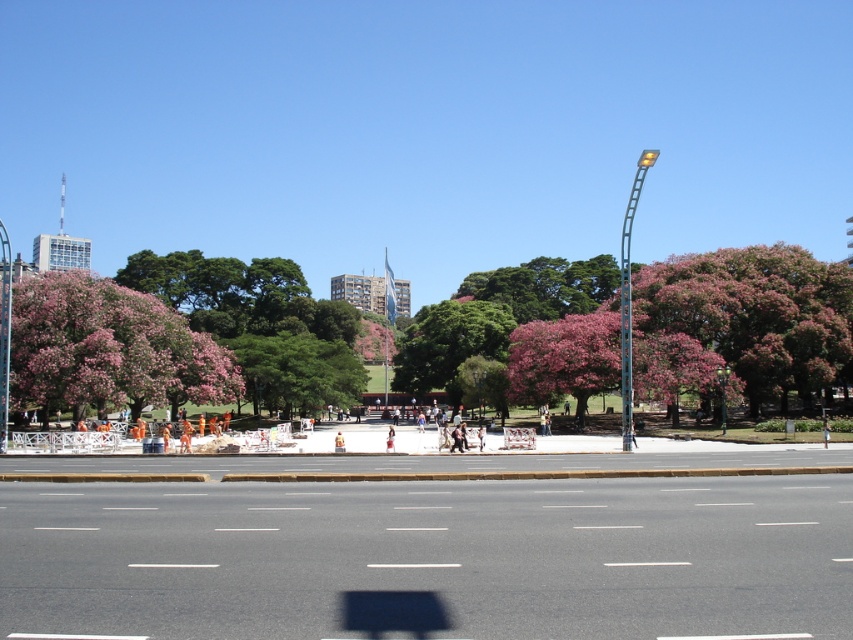
What do you see at coordinates (756, 314) in the screenshot? I see `pink matte tree at upper right` at bounding box center [756, 314].

Which is below, pink matte tree at upper right or pink textured tree at center?

pink textured tree at center is lower down.

Is point (810, 269) positioned in front of point (363, 380)?

Yes, it is.

This screenshot has width=853, height=640. I want to click on pink matte tree at upper right, so click(x=756, y=314).

Between point (48, 400) and point (352, 368), which one is positioned in front?

Point (48, 400) is in front.

Does pink bloom tree at left come in front of pink textured tree at center?

Yes, it is.

The image size is (853, 640). In order to click on pink bloom tree at left in this screenshot , I will do `click(109, 349)`.

You are a GUI agent. You are given a task and a screenshot of the screen. Output one action in this format:
    pyautogui.click(x=<x>, y=<y>)
    Task: Click on the pink bloom tree at left
    
    Given the screenshot: What is the action you would take?
    pyautogui.click(x=109, y=349)

Locate an element on the screen. The image size is (853, 640). pink matte tree at upper right is located at coordinates (756, 314).

What do you see at coordinates (756, 314) in the screenshot? The height and width of the screenshot is (640, 853). I see `pink matte tree at upper right` at bounding box center [756, 314].

Locate an element on the screen. The width and height of the screenshot is (853, 640). pink matte tree at upper right is located at coordinates (756, 314).